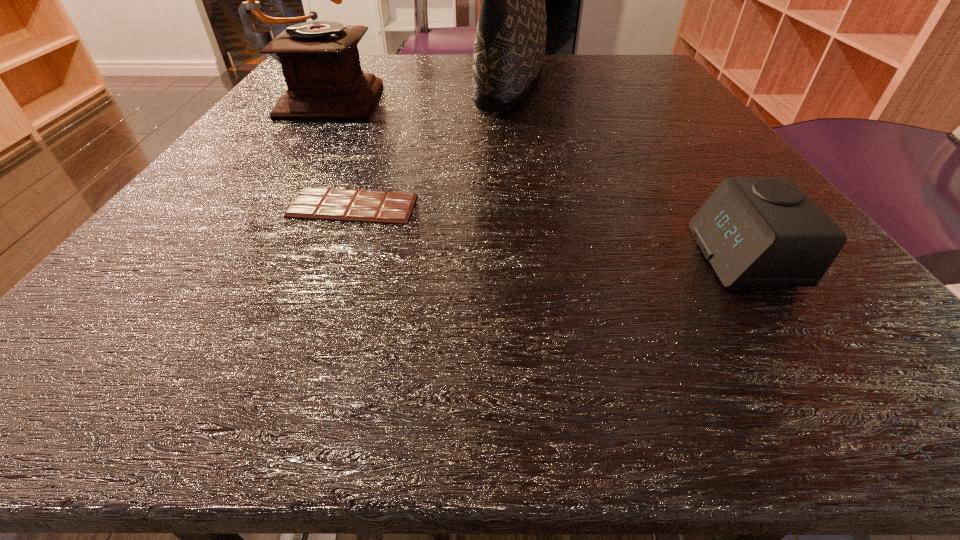
Image resolution: width=960 pixels, height=540 pixels. What are the coordinates of `tote bag` in the screenshot? It's located at (510, 41).

Identify the location of the tallest object. pos(510,41).

Where is `phonograph record`? The height and width of the screenshot is (540, 960). phonograph record is located at coordinates (320, 61).

Locate an element on the screen. The image size is (960, 540). the rightmost object is located at coordinates (755, 231).

Identify the location of alarm clock. The image size is (960, 540). (755, 231).

At what (x,y) coordinates should I click in order to perform the action: click on the shortest object. Please return your answer as a coordinate pair (x, y). Looking at the image, I should click on (312, 203).

Find the location of a particular element. This screenshot has width=960, height=540. chocolate bar is located at coordinates (312, 203).

You are a GUI agent. You are given a task and a screenshot of the screen. Output one action in this format:
    pyautogui.click(x=<x>, y=<y>)
    Task: Click on the free space located on the front of the second object from right to left
    The image size is (960, 540).
    Given the screenshot: What is the action you would take?
    pyautogui.click(x=535, y=251)

At what (x,y) coordinates should I click in order to perform the action: click on free space located on the horn of the third shortest object. Please return your answer as a coordinate pair (x, y). This screenshot has height=540, width=960. Looking at the image, I should click on (487, 94).

The image size is (960, 540). Identify the location of free space located 0.260m on the front-facing side of the alarm clock. (475, 256).